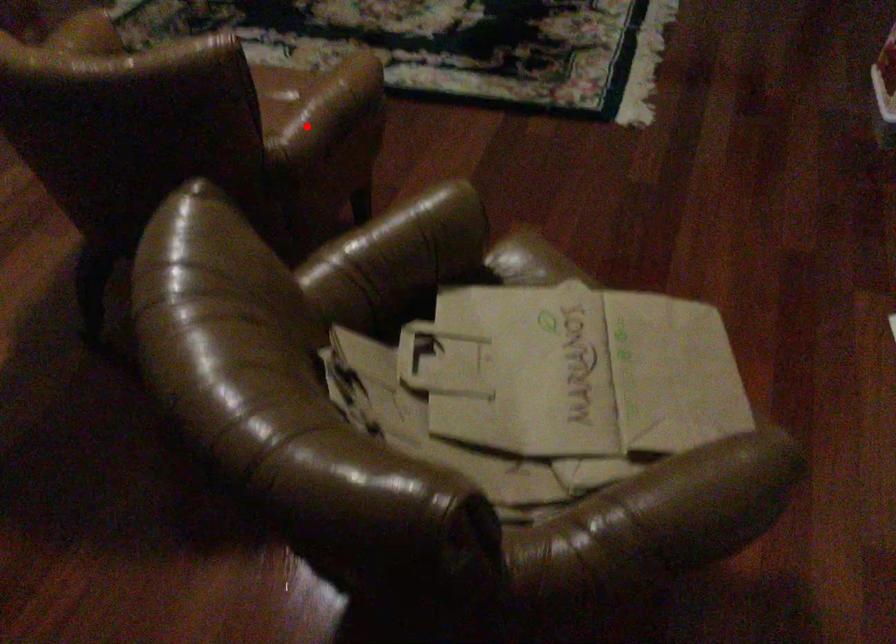
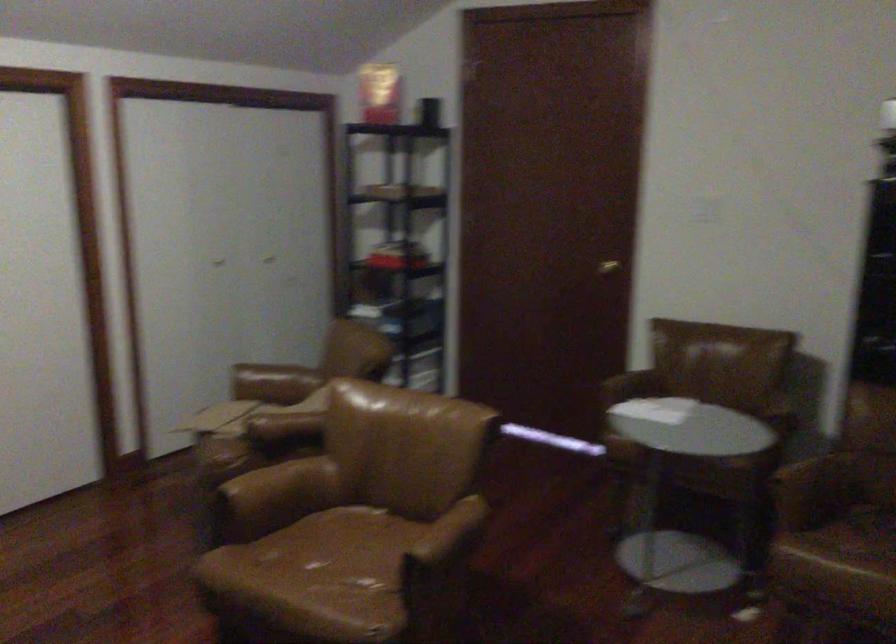
Locate, in the second image, the point that corresponds to the highlighted location in the first image.

(280, 484)